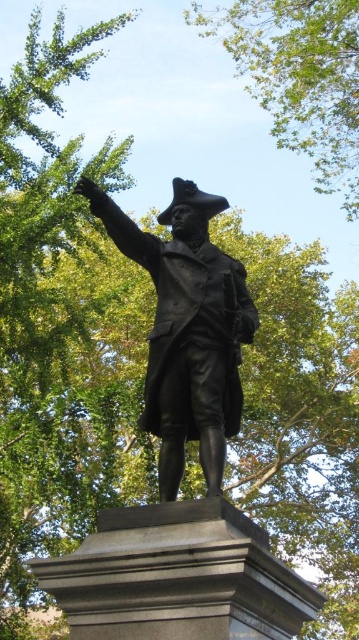
You are a sculptor who wants to create a new statue that is wider than the existing bronze statue at center. You observe the green leafy tree at upper center in the image. Can you use the tree as a reference to determine the minimum width your new statue should be?

The bronze statue at center is thinner than the green leafy tree at upper center. To ensure your new statue is wider than the bronze statue at center, it should be at least as wide as the green leafy tree at upper center.

You are a park visitor standing in front of the bronze statue at center. You notice a green leafy tree at upper center in the background. Based on the scene, which object is taller?

The bronze statue at center has a lesser height compared to the green leafy tree at upper center, so the green leafy tree at upper center is taller.

You are standing in front of the bronze statue of a historical figure. The statue is pointing towards a specific direction. If you were to walk straight towards the point marked at coordinates (176, 244), which is 21.21 meters away from you, would you end up facing the same direction as the statue is pointing?

The point marked at coordinates (176, 244) is 21.21 meters away from the viewer. Since the statue is pointing forward with one arm extended in a gesture of command or direction, walking straight towards that point would mean you are moving in the same direction the statue is pointing. Therefore, yes, you would end up facing the same direction as the statue.